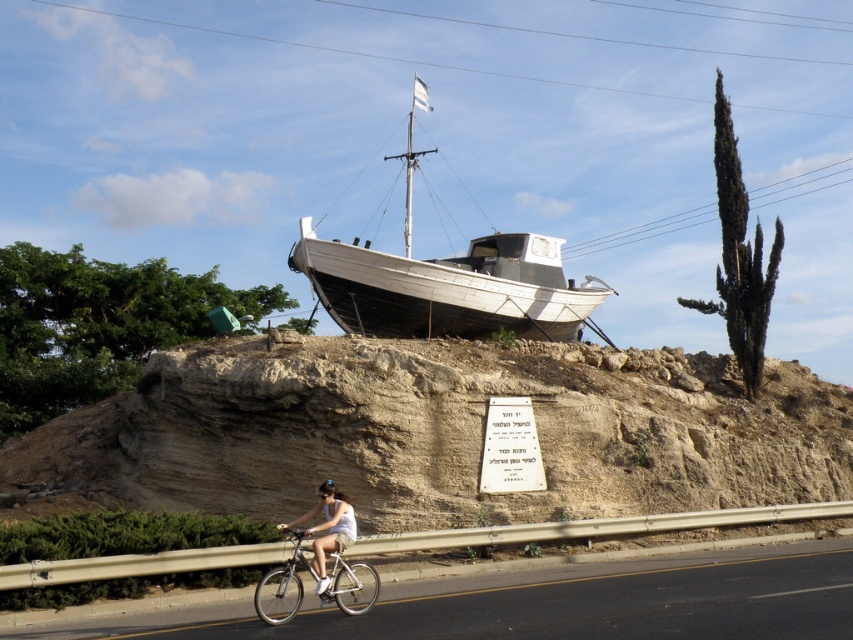
You are standing at the point labeled point (442,433) in the image. What is the terrain like at that location?

The terrain at point (442,433) is a brown sandy hillside at center.

You are standing at the base of the rocky mound and want to place a white cotton dress at lower center near the white matte boat at center. Given that the distance between them is 146.75 feet, can you estimate whether the dress will be within a 150 feet safety zone around the boat?

The white matte boat at center and white cotton dress at lower center are 146.75 feet apart. Since 146.75 feet is less than 150 feet, the dress is within the safety zone around the boat.

You are standing at the base of the rocky mound where the boat is perched. You want to place a small flag exactly at the point marked as point [262,604]. Based on the given information, can you estimate whether you can reach that point from your current position without moving closer than 36 meters to the boat?

The point [262,604] is 36.13 meters away from the viewer. Since the required minimum distance is 36 meters, you are just slightly beyond the required distance. Therefore, you need to move about 0.13 meters closer to reach the point without violating the distance constraint.